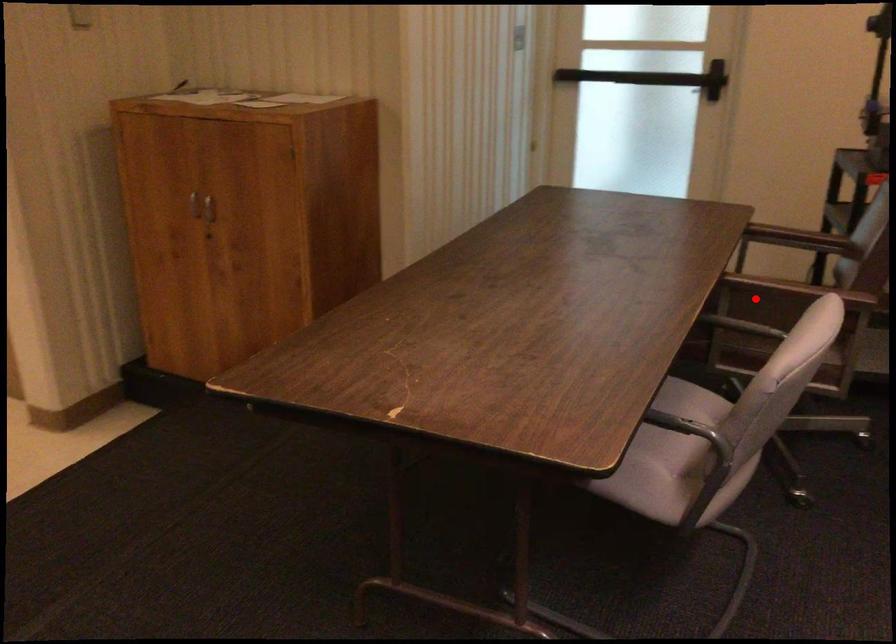
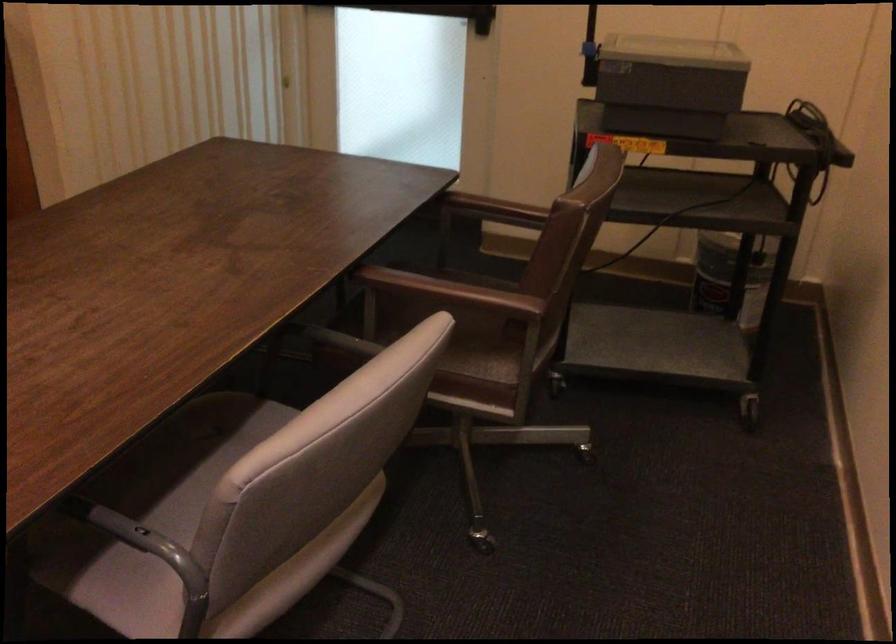
Find the pixel in the second image that matches the highlighted location in the first image.

(460, 289)